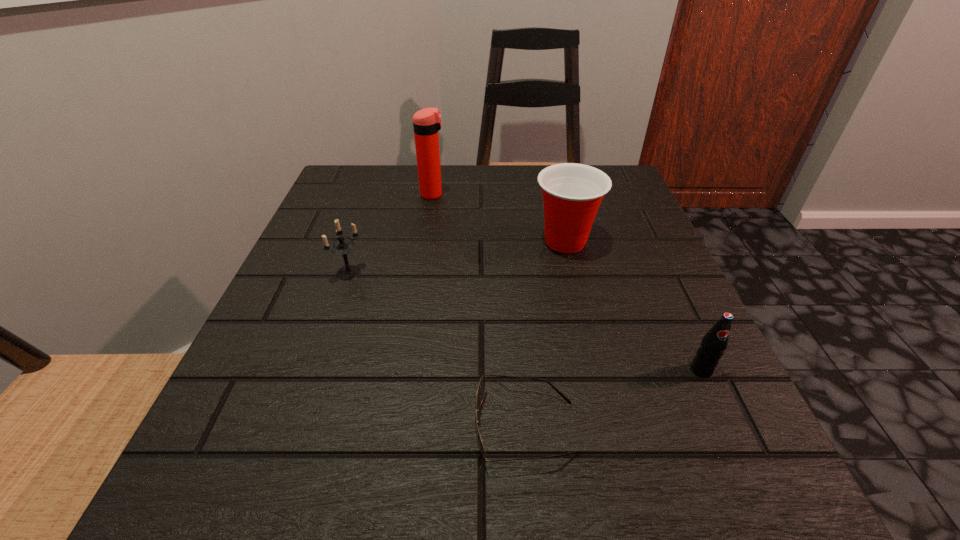
You are a GUI agent. You are given a task and a screenshot of the screen. Output one action in this format:
    pyautogui.click(x=<x>, y=<y>)
    Task: Click on the cup at the right edge
    Image resolution: width=960 pixels, height=540 pixels.
    Given the screenshot: What is the action you would take?
    pyautogui.click(x=572, y=193)

You are a GUI agent. You are given a task and a screenshot of the screen. Output one action in this format:
    pyautogui.click(x=<x>, y=<y>)
    Task: Click on the pop present at the right edge
    This screenshot has width=960, height=540.
    Given the screenshot: What is the action you would take?
    pyautogui.click(x=714, y=343)

The width and height of the screenshot is (960, 540). What are the coordinates of `vacant space at the far edge of the desktop` in the screenshot? It's located at (399, 188).

Find the location of a particular element. This screenshot has width=960, height=540. free space at the near edge is located at coordinates (593, 517).

In the image, there is a desktop. Where is `vacant space at the left edge`? This screenshot has width=960, height=540. vacant space at the left edge is located at coordinates 346,227.

In the image, there is a desktop. Where is `vacant space at the right edge`? vacant space at the right edge is located at coordinates (646, 362).

Identify the location of free space at the far left corner of the desktop. (383, 201).

Locate an element on the screen. This screenshot has width=960, height=540. vacant space at the near left corner is located at coordinates (220, 466).

The image size is (960, 540). I want to click on blank space at the far right corner of the desktop, so click(x=628, y=192).

At what (x,y) coordinates should I click in order to perform the action: click on vacant region at the near right corner of the desktop. Please return your answer as a coordinate pair (x, y). The image size is (960, 540). Looking at the image, I should click on (667, 461).